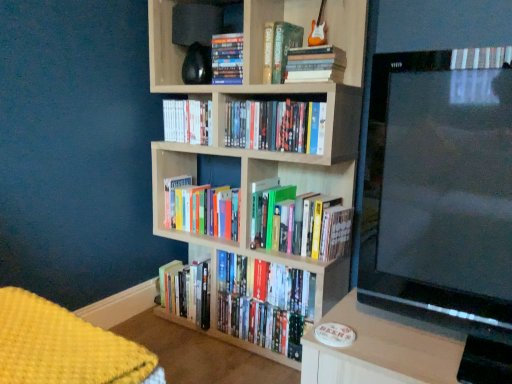
Question: Would you say hardcover books at center, the sixth book from the top, is to the left or to the right of hardcover books at center, which is the fourth book in bottom-to-top order, in the picture?

Choices:
 (A) left
 (B) right

Answer: (A)

Question: From the image's perspective, is hardcover books at center, the sixth book from the top, located above or below hardcover books at center, which is the fourth book in bottom-to-top order?

Choices:
 (A) above
 (B) below

Answer: (B)

Question: Which object is positioned closest to the hardcover book at upper center, the 3th book in the top-to-bottom sequence?

Choices:
 (A) yellow knitted blanket at lower left
 (B) black glossy tv at right
 (C) hardcover books at upper center, which is the 2th book from top to bottom
 (D) matte black shelf at upper center
 (E) hardcover books at center, placed as the first book when sorted from bottom to top

Answer: (C)

Question: Which object is the closest to the hardcover books at center, marked as the 3th book in a bottom-to-top arrangement?

Choices:
 (A) hardcover books at center, arranged as the fifth book when viewed from the top
 (B) hardcover book at center, the 5th book when ordered from bottom to top
 (C) black glossy tv at right
 (D) hardcover books at center, placed as the first book when sorted from bottom to top
 (E) yellow knitted blanket at lower left

Answer: (D)